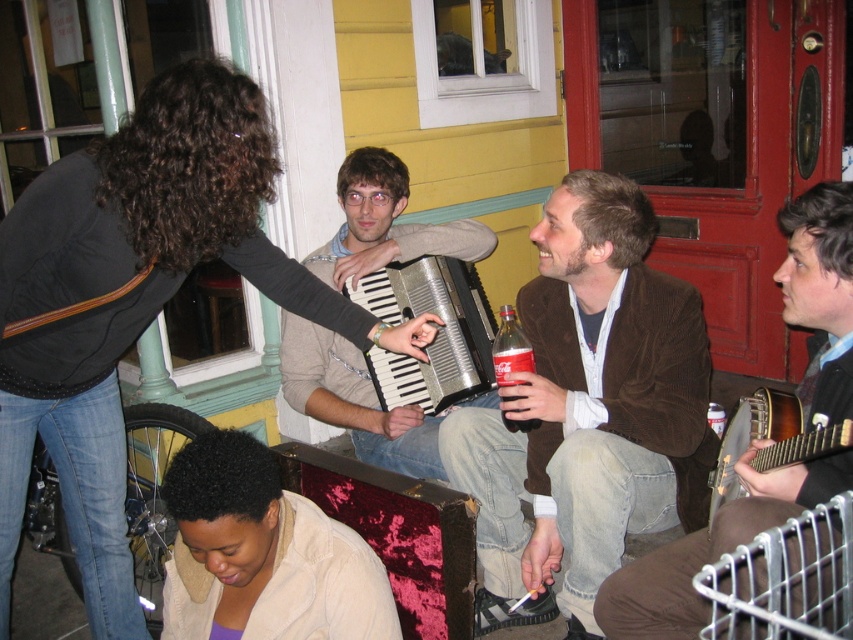
The width and height of the screenshot is (853, 640). Describe the element at coordinates (352, 401) in the screenshot. I see `metallic accordion at center` at that location.

Who is taller, metallic accordion at center or wooden banjo at right?

metallic accordion at center is taller.

Describe the element at coordinates (352, 401) in the screenshot. I see `metallic accordion at center` at that location.

You are a GUI agent. You are given a task and a screenshot of the screen. Output one action in this format:
    pyautogui.click(x=<x>, y=<y>)
    Task: Click on the metallic accordion at center
    This screenshot has width=853, height=640.
    Given the screenshot: What is the action you would take?
    pyautogui.click(x=352, y=401)

Which is in front, point (339, 253) or point (444, 348)?

Point (444, 348)

Who is more distant from viewer, [321,371] or [427,371]?

Point [321,371]

The width and height of the screenshot is (853, 640). Find the location of `metallic accordion at center`. metallic accordion at center is located at coordinates (352, 401).

Which is behind, point (154, 314) or point (796, 400)?

Positioned behind is point (154, 314).

Is dark brown hair at upper left thinner than wooden banjo at right?

Incorrect, dark brown hair at upper left's width is not less than wooden banjo at right's.

Who is more distant from viewer, [16,310] or [796,417]?

The point [16,310] is more distant.

This screenshot has width=853, height=640. What are the coordinates of `dark brown hair at upper left` in the screenshot? It's located at (132, 300).